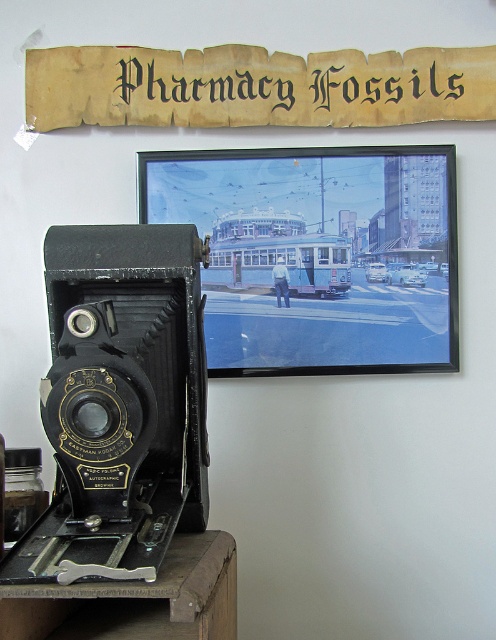
You are an antique collector examining a display case containing a matte black camera at left and a metallic silver frame at upper center. You need to determine which object is smaller. Can you identify the smaller one?

The metallic silver frame at upper center has a smaller size compared to the matte black camera at left, so the metallic silver frame at upper center is the smaller object.

You are an antique collector examining a display case containing the matte black camera at left and a yellowed parchment sign at upper center. You want to place a small price tag next to the item that is on the right side. Which object should you attach it to?

The yellowed parchment sign at upper center is on the right side compared to the matte black camera at left, so you should attach the price tag next to the yellowed parchment sign at upper center.

You are an antique collector examining the vintage Eastman Kodak camera on display. You notice two items at the upper center of the scene. Which one is closer to you, the metallic silver frame at upper center or the yellowed parchment sign at upper center?

The metallic silver frame at upper center is closer to you than the yellowed parchment sign at upper center.